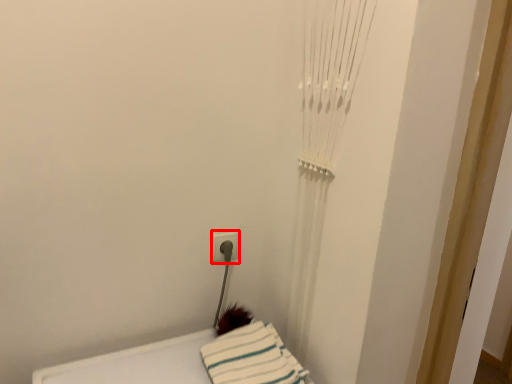
Question: From the image's perspective, where is electric outlet (annotated by the red box) located in relation to sheet in the image?

Choices:
 (A) below
 (B) above

Answer: (B)